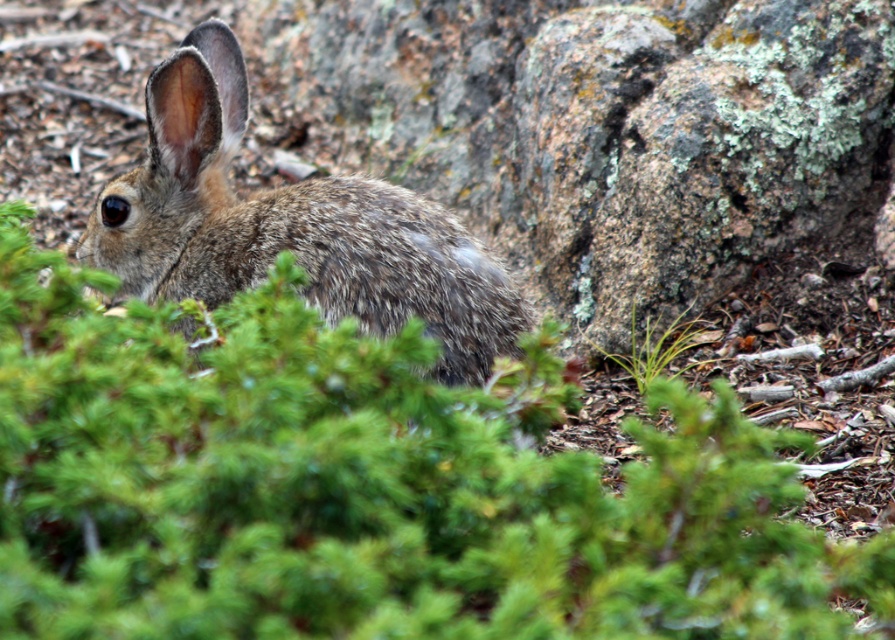
Question: Which point is closer to the camera taking this photo?

Choices:
 (A) (245, 104)
 (B) (667, 358)

Answer: (A)

Question: Which object is farther from the camera taking this photo?

Choices:
 (A) green leafy plant at center
 (B) fuzzy brown rabbit at center

Answer: (A)

Question: Does fuzzy brown rabbit at center appear over green leafy plant at center?

Choices:
 (A) yes
 (B) no

Answer: (A)

Question: Can you confirm if fuzzy brown rabbit at center is thinner than green leafy plant at center?

Choices:
 (A) no
 (B) yes

Answer: (A)

Question: Does fuzzy brown rabbit at center come behind green leafy plant at center?

Choices:
 (A) yes
 (B) no

Answer: (B)

Question: Which object appears closest to the camera in this image?

Choices:
 (A) fuzzy brown rabbit at center
 (B) green leafy plant at center

Answer: (A)